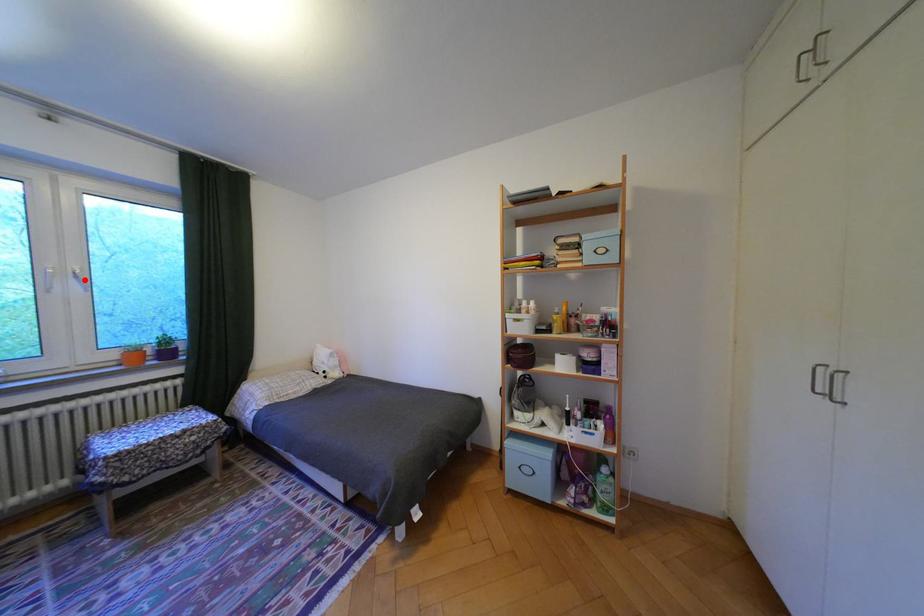
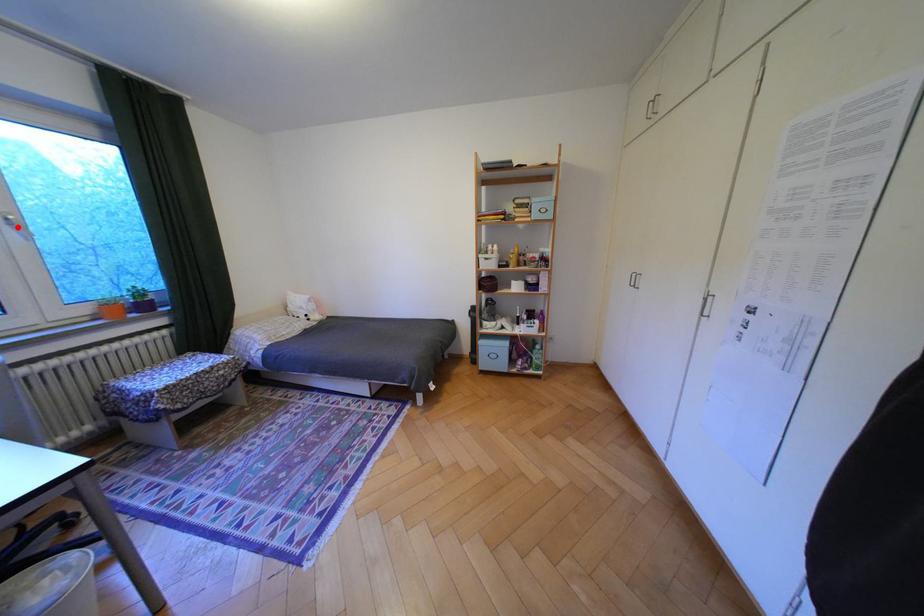
I am providing you with two images of the same scene from different viewpoints. A red point is marked on the first image and another point is marked on the second image. Do the highlighted points in image1 and image2 indicate the same real-world spot?

Yes